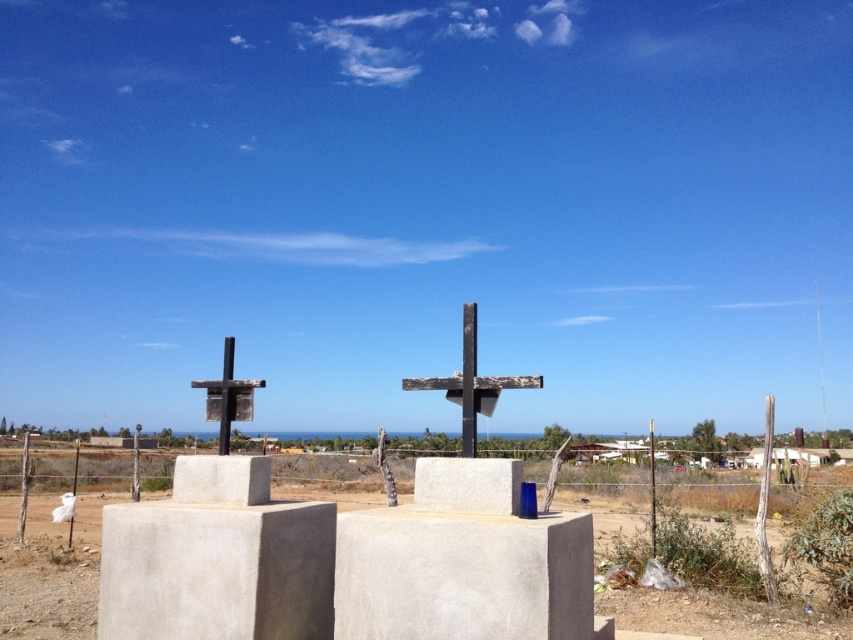
Question: Is white concrete block at center below weathered wood cross at center?

Choices:
 (A) no
 (B) yes

Answer: (B)

Question: Considering the real-world distances, which object is farthest from the white concrete block at center?

Choices:
 (A) smooth concrete block at center
 (B) smooth wooden cross at center
 (C) dirt field at center
 (D) gray concrete block at center

Answer: (C)

Question: Which object is farther from the camera taking this photo?

Choices:
 (A) smooth concrete block at center
 (B) white concrete block at center
 (C) weathered wood cross at center

Answer: (C)

Question: Which point is farther to the camera?

Choices:
 (A) white concrete block at center
 (B) smooth wooden cross at center

Answer: (B)

Question: Is gray concrete block at center behind smooth wooden cross at center?

Choices:
 (A) no
 (B) yes

Answer: (A)

Question: Is dirt field at center positioned behind white concrete block at center?

Choices:
 (A) no
 (B) yes

Answer: (B)